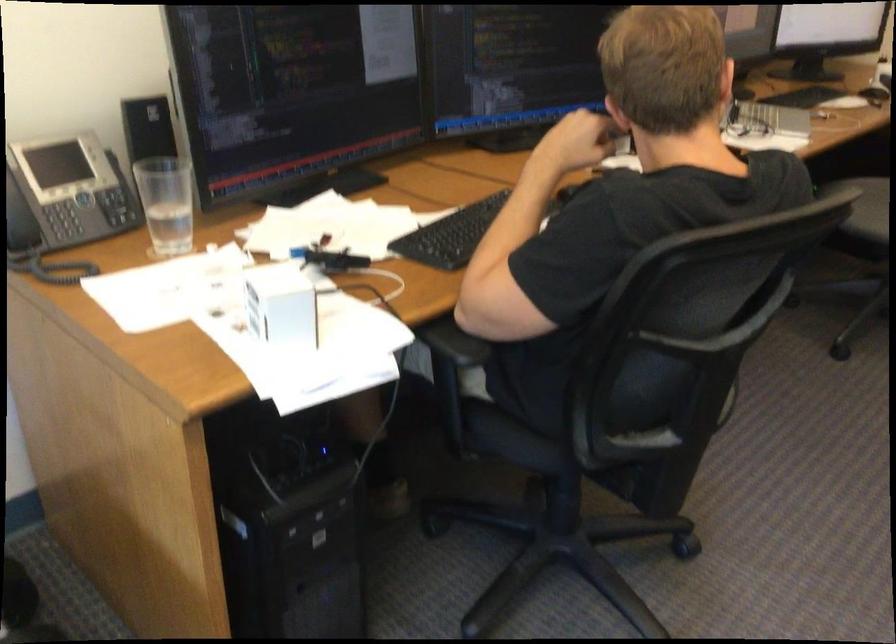
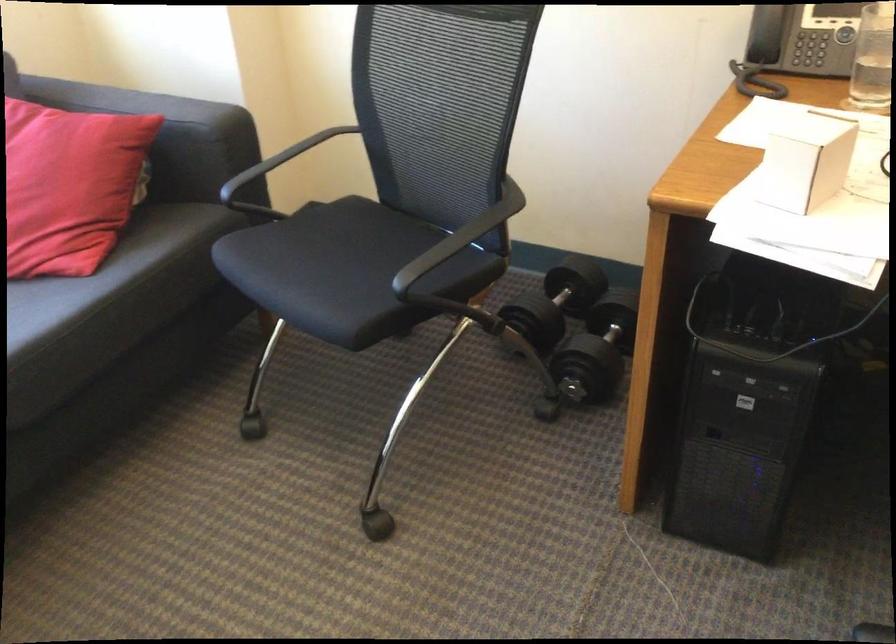
Find the pixel in the second image that matches the point at 295,304 in the first image.

(805, 162)